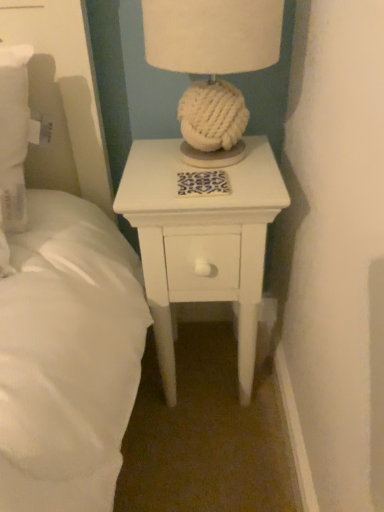
What are the coordinates of `white knitted ball at center` in the screenshot? It's located at click(x=212, y=59).

Describe the element at coordinates (212, 59) in the screenshot. This screenshot has width=384, height=512. I see `white knitted ball at center` at that location.

The width and height of the screenshot is (384, 512). I want to click on white painted wood nightstand at center, so click(201, 238).

The height and width of the screenshot is (512, 384). What do you see at coordinates (201, 238) in the screenshot? I see `white painted wood nightstand at center` at bounding box center [201, 238].

In order to click on white knitted ball at center in this screenshot , I will do `click(212, 59)`.

Considering the positions of objects white knitted ball at center and white painted wood nightstand at center in the image provided, who is more to the left, white knitted ball at center or white painted wood nightstand at center?

white painted wood nightstand at center is more to the left.

Between white knitted ball at center and white painted wood nightstand at center, which one is positioned behind?

white painted wood nightstand at center is further from the camera.

Considering the positions of points (154, 11) and (145, 230), is point (154, 11) closer to camera compared to point (145, 230)?

Yes.

From the image's perspective, is white knitted ball at center located above or below white painted wood nightstand at center?

white knitted ball at center is situated higher than white painted wood nightstand at center in the image.

From a real-world perspective, who is located higher, white knitted ball at center or white painted wood nightstand at center?

white knitted ball at center is physically above.

Does white knitted ball at center have a greater width compared to white painted wood nightstand at center?

Incorrect, the width of white knitted ball at center does not surpass that of white painted wood nightstand at center.

Considering the relative sizes of white knitted ball at center and white painted wood nightstand at center in the image provided, is white knitted ball at center taller than white painted wood nightstand at center?

No.

In terms of size, does white knitted ball at center appear bigger or smaller than white painted wood nightstand at center?

Considering their sizes, white knitted ball at center takes up less space than white painted wood nightstand at center.

Would you say white knitted ball at center is outside white painted wood nightstand at center?

Yes.

Are white knitted ball at center and white painted wood nightstand at center located far from each other?

No, white knitted ball at center is in close proximity to white painted wood nightstand at center.

Is white knitted ball at center turned away from white painted wood nightstand at center?

white knitted ball at center does not have its back to white painted wood nightstand at center.

Measure the distance between white knitted ball at center and white painted wood nightstand at center.

white knitted ball at center and white painted wood nightstand at center are 8.59 inches apart.

You are a GUI agent. You are given a task and a screenshot of the screen. Output one action in this format:
    pyautogui.click(x=<x>, y=<y>)
    Task: Click on the nightstand on the left of white knitted ball at center
    This screenshot has height=512, width=384.
    Given the screenshot: What is the action you would take?
    pos(201,238)

Does white painted wood nightstand at center appear on the right side of white knitted ball at center?

No.

Which object is closer to the camera, white painted wood nightstand at center or white knitted ball at center?

white knitted ball at center is more forward.

Does point (216, 239) come closer to viewer compared to point (205, 104)?

No, (216, 239) is behind (205, 104).

From the image's perspective, is white painted wood nightstand at center positioned above or below white knitted ball at center?

Clearly, from the image's perspective, white painted wood nightstand at center is below white knitted ball at center.

From a real-world perspective, is white painted wood nightstand at center above or below white knitted ball at center?

From a real-world perspective, white painted wood nightstand at center is physically below white knitted ball at center.

In the scene shown: Which of these two, white painted wood nightstand at center or white knitted ball at center, is thinner?

With smaller width is white knitted ball at center.

Can you confirm if white painted wood nightstand at center is taller than white knitted ball at center?

Correct, white painted wood nightstand at center is much taller as white knitted ball at center.

Between white painted wood nightstand at center and white knitted ball at center, which one has smaller size?

white knitted ball at center.

Could white knitted ball at center be considered to be inside white painted wood nightstand at center?

Actually, white knitted ball at center is outside white painted wood nightstand at center.

Are white painted wood nightstand at center and white knitted ball at center far apart?

No.

Is white painted wood nightstand at center aimed at white knitted ball at center?

No, white painted wood nightstand at center does not turn towards white knitted ball at center.

Locate an element on the screen. nightstand below the white knitted ball at center (from the image's perspective) is located at coordinates (201, 238).

Locate an element on the screen. nightstand lying below the white knitted ball at center (from the image's perspective) is located at coordinates (201, 238).

The height and width of the screenshot is (512, 384). I want to click on nightstand that appears below the white knitted ball at center (from a real-world perspective), so click(x=201, y=238).